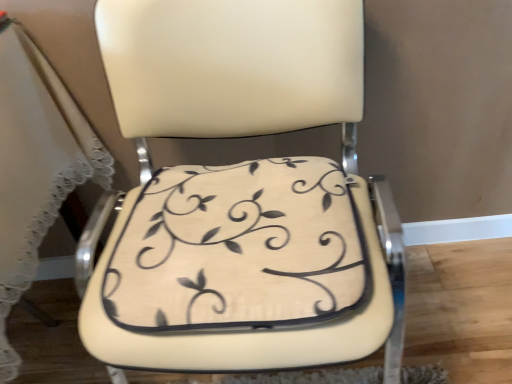
Question: Can we say beige leather chair at center lies outside beige fabric cushion at center?

Choices:
 (A) no
 (B) yes

Answer: (B)

Question: Considering the relative sizes of beige leather chair at center and beige fabric cushion at center in the image provided, is beige leather chair at center smaller than beige fabric cushion at center?

Choices:
 (A) yes
 (B) no

Answer: (B)

Question: Could you tell me if beige leather chair at center is turned towards beige fabric cushion at center?

Choices:
 (A) yes
 (B) no

Answer: (A)

Question: Is beige leather chair at center shorter than beige fabric cushion at center?

Choices:
 (A) yes
 (B) no

Answer: (B)

Question: Does beige leather chair at center have a greater width compared to beige fabric cushion at center?

Choices:
 (A) yes
 (B) no

Answer: (A)

Question: Would you say beige fabric cushion at center is part of beige leather chair at center's contents?

Choices:
 (A) no
 (B) yes

Answer: (B)

Question: Can you confirm if beige fabric cushion at center is shorter than beige leather chair at center?

Choices:
 (A) no
 (B) yes

Answer: (B)

Question: Is beige leather chair at center surrounded by beige fabric cushion at center?

Choices:
 (A) no
 (B) yes

Answer: (A)

Question: Is beige fabric cushion at center far from beige leather chair at center?

Choices:
 (A) no
 (B) yes

Answer: (A)

Question: From the image's perspective, is beige fabric cushion at center beneath beige leather chair at center?

Choices:
 (A) yes
 (B) no

Answer: (A)

Question: Does beige fabric cushion at center have a lesser width compared to beige leather chair at center?

Choices:
 (A) no
 (B) yes

Answer: (B)

Question: Is beige fabric cushion at center to the left of beige leather chair at center from the viewer's perspective?

Choices:
 (A) yes
 (B) no

Answer: (A)

Question: Looking at their shapes, would you say beige fabric cushion at center is wider or thinner than beige leather chair at center?

Choices:
 (A) wide
 (B) thin

Answer: (B)